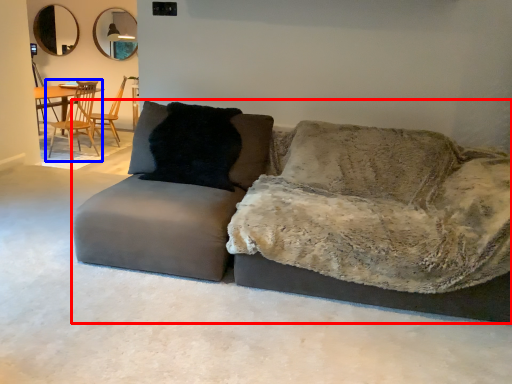
Question: Which object appears farthest to the camera in this image, studio couch (highlighted by a red box) or chair (highlighted by a blue box)?

Choices:
 (A) studio couch
 (B) chair

Answer: (B)